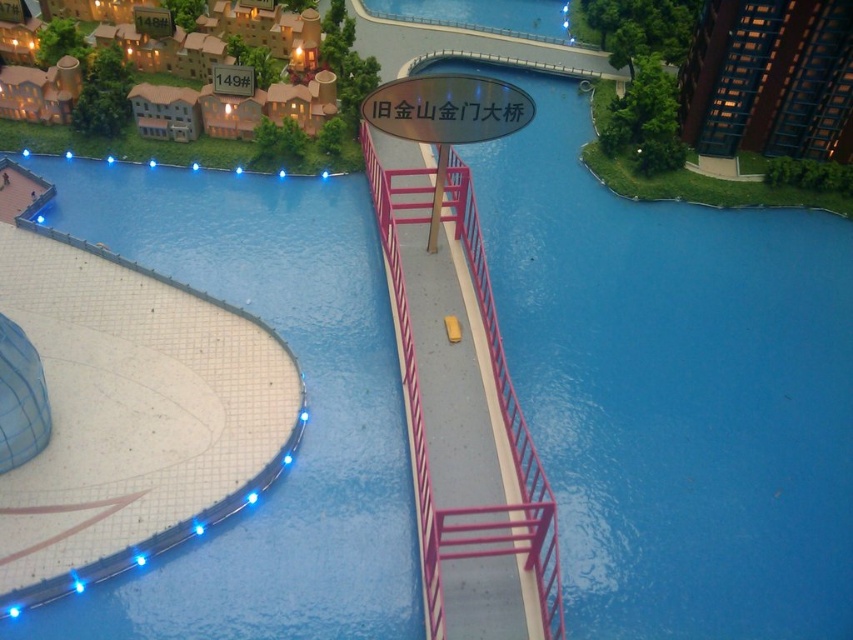
Is point (509, 148) in front of point (796, 148)?

No, it is not.

Is the position of blue glossy water at center more distant than that of glassy blue skyscraper at upper right?

No, it is in front of glassy blue skyscraper at upper right.

You are a GUI agent. You are given a task and a screenshot of the screen. Output one action in this format:
    pyautogui.click(x=<x>, y=<y>)
    Task: Click on the blue glossy water at center
    The image size is (853, 640).
    Given the screenshot: What is the action you would take?
    pyautogui.click(x=672, y=388)

At what (x,y) coordinates should I click in order to perform the action: click on blue glossy water at center. Please return your answer as a coordinate pair (x, y). This screenshot has width=853, height=640. Looking at the image, I should click on (672, 388).

Between blue glossy pool at lower left and glassy blue skyscraper at upper right, which one appears on the right side from the viewer's perspective?

glassy blue skyscraper at upper right is more to the right.

Which of these two, blue glossy pool at lower left or glassy blue skyscraper at upper right, stands taller?

Standing taller between the two is blue glossy pool at lower left.

Describe the element at coordinates (306, 410) in the screenshot. I see `blue glossy pool at lower left` at that location.

Identify the location of blue glossy pool at lower left. (306, 410).

Can you confirm if blue glossy water at center is positioned above blue glossy pool at lower left?

Yes.

You are a GUI agent. You are given a task and a screenshot of the screen. Output one action in this format:
    pyautogui.click(x=<x>, y=<y>)
    Task: Click on the blue glossy water at center
    The width and height of the screenshot is (853, 640).
    Given the screenshot: What is the action you would take?
    pyautogui.click(x=672, y=388)